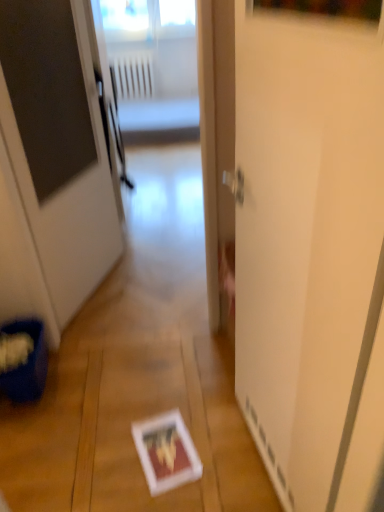
The height and width of the screenshot is (512, 384). In order to click on empty space that is ontop of white plastic radiator at upper center (from a real-world perspective) in this screenshot , I will do `click(134, 57)`.